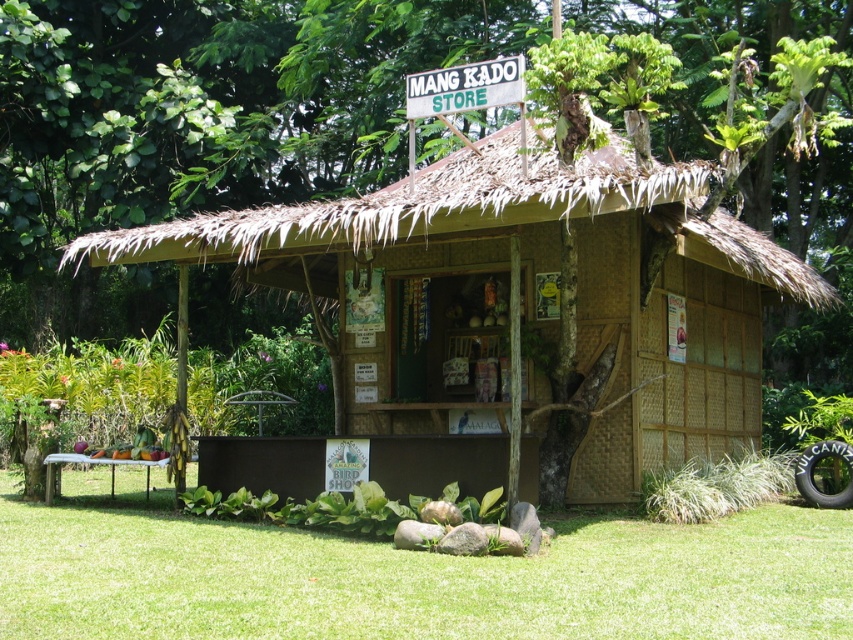
Who is positioned more to the right, bamboo hut at center or green wooden sign at upper center?

bamboo hut at center

This screenshot has width=853, height=640. What do you see at coordinates (521, 291) in the screenshot? I see `bamboo hut at center` at bounding box center [521, 291].

Where is `bamboo hut at center`? Image resolution: width=853 pixels, height=640 pixels. bamboo hut at center is located at coordinates (521, 291).

How much distance is there between green grass at lower center and green wooden sign at upper center?

green grass at lower center and green wooden sign at upper center are 5.87 meters apart from each other.

Is point (529, 614) positioned after point (440, 97)?

No, it is in front of (440, 97).

The width and height of the screenshot is (853, 640). I want to click on green grass at lower center, so click(410, 576).

Which is more to the left, bamboo hut at center or green grass at lower center?

From the viewer's perspective, green grass at lower center appears more on the left side.

Who is more distant from viewer, (363, 380) or (358, 556)?

Point (363, 380)

At what (x,y) coordinates should I click in order to perform the action: click on bamboo hut at center. Please return your answer as a coordinate pair (x, y). Image resolution: width=853 pixels, height=640 pixels. Looking at the image, I should click on (521, 291).